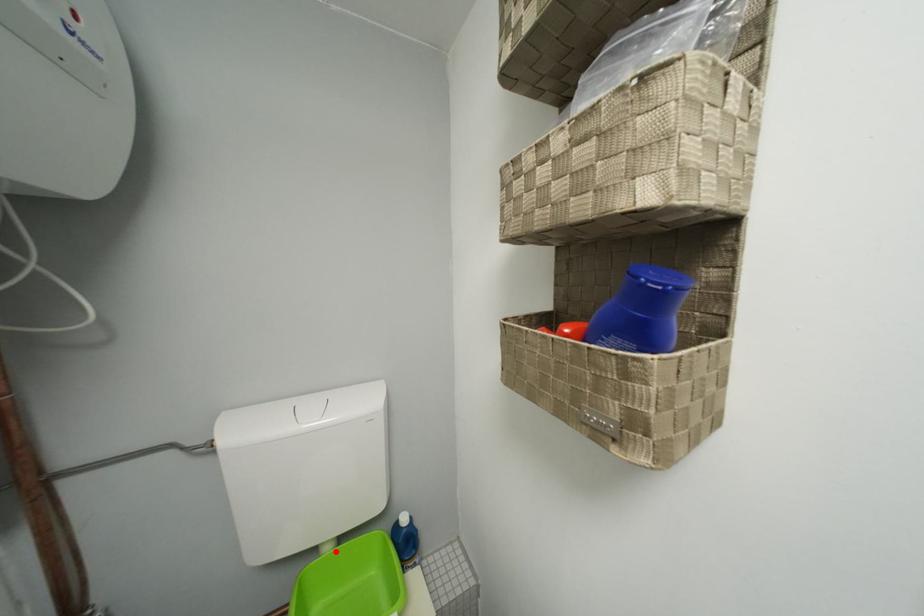
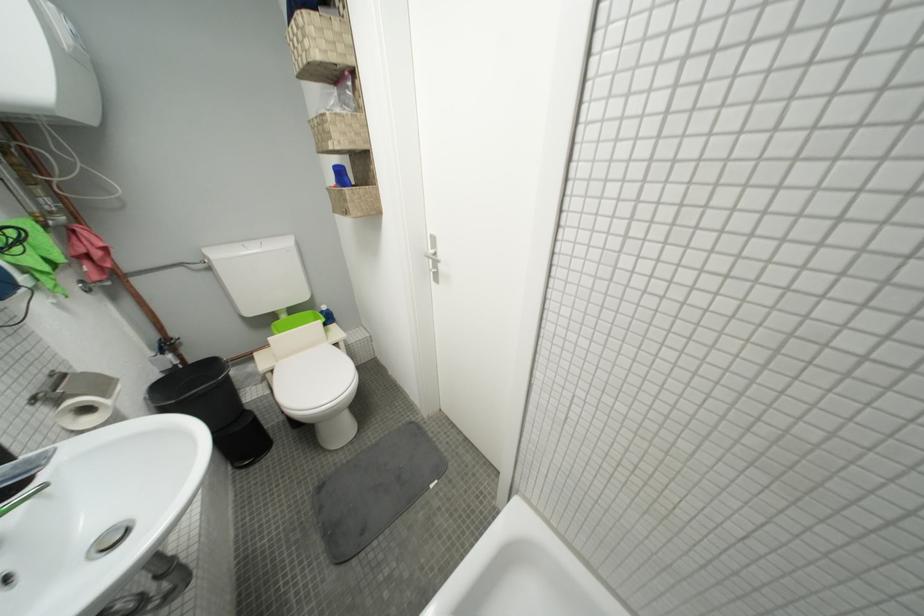
In the second image, find the point that corresponds to the highlighted location in the first image.

(293, 318)